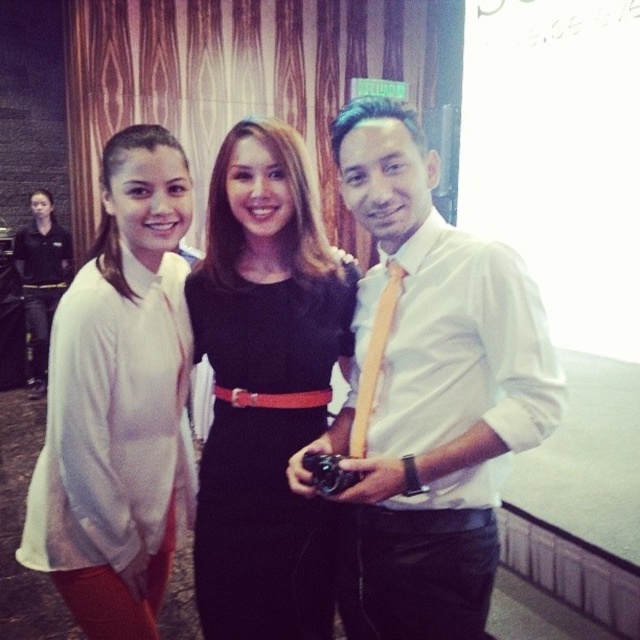
You are organizing a photo shoot and need to ensure that the matte white blouse at left and the yellow satin tie at center are visible in the frame. Based on their sizes, which object should you prioritize positioning closer to the camera to ensure visibility?

The matte white blouse at left might be wider than the yellow satin tie at center, so you should prioritize positioning the matte white blouse at left closer to the camera to ensure visibility.

You are an event photographer trying to focus on the matte white blouse at left and the yellow satin tie at center. Which one is positioned lower in the image?

The matte white blouse at left is positioned below the yellow satin tie at center, so it is lower in the image.